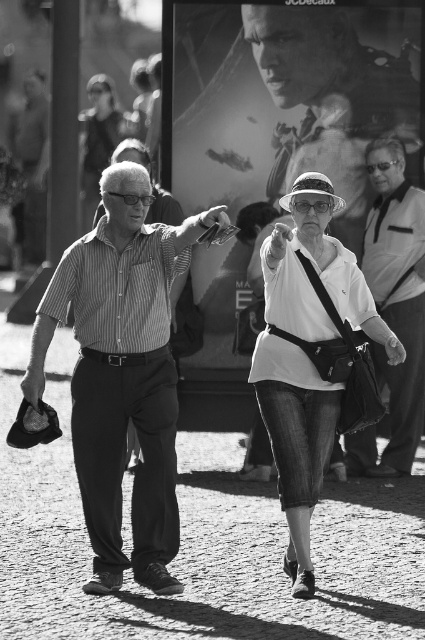
You are a photographer standing in front of the cobblestone street scene. You want to capture a closeup shot of the denim jeans at center. Based on the distance provided, is the denim jeans within the optimal focus range of your 50mm lens which has a minimum focusing distance of 2.5 feet?

The denim jeans at center is 25.14 feet away from the camera, which is beyond the 2.5 feet minimum focusing distance of the 50mm lens. Therefore, the denim jeans at center can be captured in focus.

Based on the scene description and the coordinates provided, what object is located at the point marked at coordinates (306, 355)?

The point marked at coordinates (306, 355) indicates denim jeans at center.

Based on the scene described, which of the two points, point (393, 108) or point (394, 212), is positioned farther back in the image?

Point (393, 108) is positioned farther back in the image compared to point (394, 212).